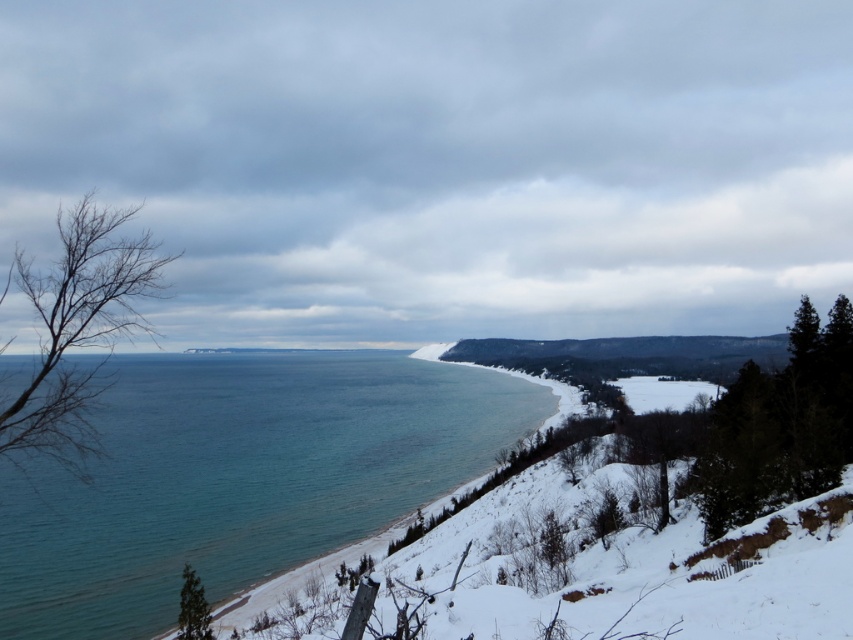
Question: Which of the following is the closest to the observer?

Choices:
 (A) dark green evergreen at right
 (B) green matte tree at lower left
 (C) bare branches at left

Answer: (C)

Question: Can you confirm if bare branches at left is positioned below green matte tree at lower left?

Choices:
 (A) yes
 (B) no

Answer: (B)

Question: Can you confirm if dark green evergreen at right is positioned below green matte tree at lower left?

Choices:
 (A) no
 (B) yes

Answer: (A)

Question: Estimate the real-world distances between objects in this image. Which object is farther from the green matte tree at lower left?

Choices:
 (A) dark green evergreen at right
 (B) clear blue water at center

Answer: (B)

Question: Which point is farther to the camera?

Choices:
 (A) (403, 410)
 (B) (708, 515)

Answer: (A)

Question: Is bare branches at left in front of dark green evergreen at right?

Choices:
 (A) yes
 (B) no

Answer: (A)